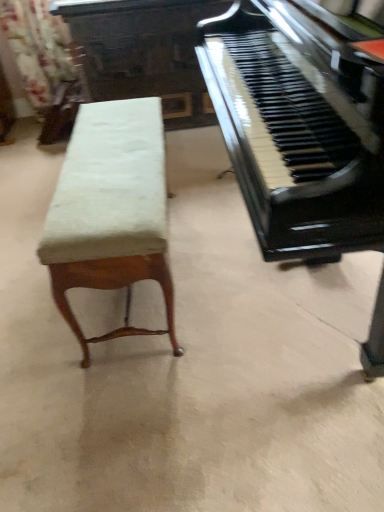
What is the approximate height of floral fabric curtain at upper left?

floral fabric curtain at upper left is 31.29 inches in height.

What do you see at coordinates (37, 49) in the screenshot?
I see `floral fabric curtain at upper left` at bounding box center [37, 49].

The width and height of the screenshot is (384, 512). Describe the element at coordinates (294, 139) in the screenshot. I see `black polished wood piano at right` at that location.

Where is `velvet upholstered bench at left`? Image resolution: width=384 pixels, height=512 pixels. velvet upholstered bench at left is located at coordinates (111, 211).

Between point (242, 140) and point (98, 338), which one is positioned behind?

Positioned behind is point (98, 338).

Can you tell me how much black polished wood piano at right and velvet upholstered bench at left differ in facing direction?

The angle between the facing direction of black polished wood piano at right and the facing direction of velvet upholstered bench at left is 180 degrees.

Find the location of `piano in front of the velvet upholstered bench at left`. piano in front of the velvet upholstered bench at left is located at coordinates (294, 139).

Which object is closer to the camera taking this photo, black polished wood piano at right or velvet upholstered bench at left?

black polished wood piano at right is in front.

Between velvet upholstered bench at left and black polished wood piano at right, which one has less height?

With less height is velvet upholstered bench at left.

Looking at this image, from the image's perspective, is velvet upholstered bench at left located beneath black polished wood piano at right?

Yes, from the image's perspective, velvet upholstered bench at left is below black polished wood piano at right.

Which object is closer to the camera, velvet upholstered bench at left or black polished wood piano at right?

black polished wood piano at right.

Considering the sizes of objects velvet upholstered bench at left and black polished wood piano at right in the image provided, who is smaller, velvet upholstered bench at left or black polished wood piano at right?

velvet upholstered bench at left is smaller.

Is black polished wood piano at right aimed at floral fabric curtain at upper left?

No, black polished wood piano at right is not oriented towards floral fabric curtain at upper left.

Which object is thinner, black polished wood piano at right or floral fabric curtain at upper left?

With smaller width is floral fabric curtain at upper left.

Is black polished wood piano at right completely or partially outside of floral fabric curtain at upper left?

Yes, black polished wood piano at right is not within floral fabric curtain at upper left.

Which of these two, velvet upholstered bench at left or floral fabric curtain at upper left, is wider?

velvet upholstered bench at left is wider.

Is velvet upholstered bench at left oriented towards floral fabric curtain at upper left?

No.

The width and height of the screenshot is (384, 512). In order to click on curtain above the velvet upholstered bench at left (from the image's perspective) in this screenshot , I will do `click(37, 49)`.

From the image's perspective, is velvet upholstered bench at left below floral fabric curtain at upper left?

Yes, from the image's perspective, velvet upholstered bench at left is beneath floral fabric curtain at upper left.

Is floral fabric curtain at upper left bigger or smaller than velvet upholstered bench at left?

floral fabric curtain at upper left is smaller than velvet upholstered bench at left.

Is floral fabric curtain at upper left oriented towards velvet upholstered bench at left?

Yes, floral fabric curtain at upper left is aimed at velvet upholstered bench at left.

Is floral fabric curtain at upper left directly adjacent to velvet upholstered bench at left?

No.

Between floral fabric curtain at upper left and velvet upholstered bench at left, which one is positioned behind?

Positioned behind is floral fabric curtain at upper left.

Can you confirm if floral fabric curtain at upper left is thinner than black polished wood piano at right?

Indeed, floral fabric curtain at upper left has a lesser width compared to black polished wood piano at right.

Which is behind, point (29, 56) or point (344, 100)?

Positioned behind is point (29, 56).

Considering the sizes of objects floral fabric curtain at upper left and black polished wood piano at right in the image provided, who is smaller, floral fabric curtain at upper left or black polished wood piano at right?

Smaller between the two is floral fabric curtain at upper left.

Is floral fabric curtain at upper left far from black polished wood piano at right?

floral fabric curtain at upper left is positioned a significant distance from black polished wood piano at right.

The image size is (384, 512). Identify the location of piano in front of the velvet upholstered bench at left. pyautogui.click(x=294, y=139).

I want to click on piano above the velvet upholstered bench at left (from a real-world perspective), so click(x=294, y=139).

From the image, which object appears to be farther from floral fabric curtain at upper left, velvet upholstered bench at left or black polished wood piano at right?

Based on the image, black polished wood piano at right appears to be further to floral fabric curtain at upper left.

Estimate the real-world distances between objects in this image. Which object is further from black polished wood piano at right, velvet upholstered bench at left or floral fabric curtain at upper left?

Based on the image, floral fabric curtain at upper left appears to be further to black polished wood piano at right.

In the scene shown: When comparing their distances from velvet upholstered bench at left, does black polished wood piano at right or floral fabric curtain at upper left seem closer?

The object closer to velvet upholstered bench at left is black polished wood piano at right.

From the image, which object appears to be nearer to velvet upholstered bench at left, floral fabric curtain at upper left or black polished wood piano at right?

Based on the image, black polished wood piano at right appears to be nearer to velvet upholstered bench at left.

Estimate the real-world distances between objects in this image. Which object is further from black polished wood piano at right, floral fabric curtain at upper left or velvet upholstered bench at left?

Based on the image, floral fabric curtain at upper left appears to be further to black polished wood piano at right.

Estimate the real-world distances between objects in this image. Which object is further from floral fabric curtain at upper left, black polished wood piano at right or velvet upholstered bench at left?

The object further to floral fabric curtain at upper left is black polished wood piano at right.

Where is `furniture positioned between black polished wood piano at right and floral fabric curtain at upper left from near to far`? furniture positioned between black polished wood piano at right and floral fabric curtain at upper left from near to far is located at coordinates (111, 211).